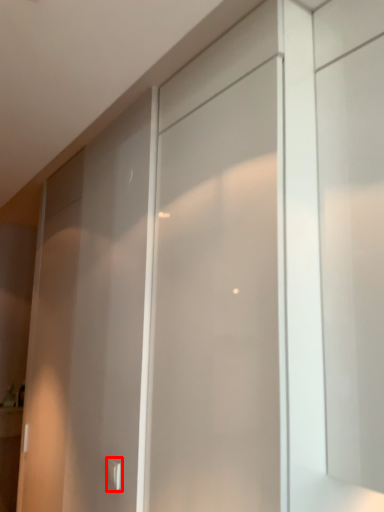
Question: From the image's perspective, what is the correct spatial positioning of door handle (annotated by the red box) in reference to screen door?

Choices:
 (A) above
 (B) below

Answer: (B)